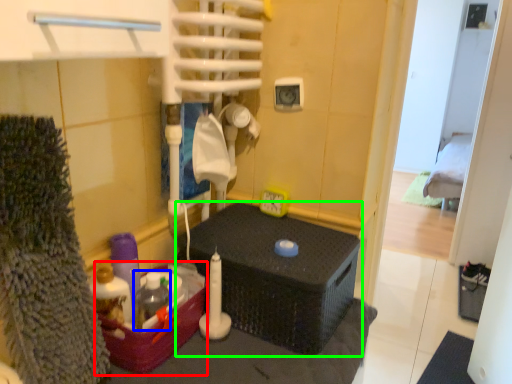
Question: Estimate the real-world distances between objects in this image. Which object is farther from box (highlighted by a red box), bottle (highlighted by a blue box) or furniture (highlighted by a green box)?

Choices:
 (A) bottle
 (B) furniture

Answer: (B)